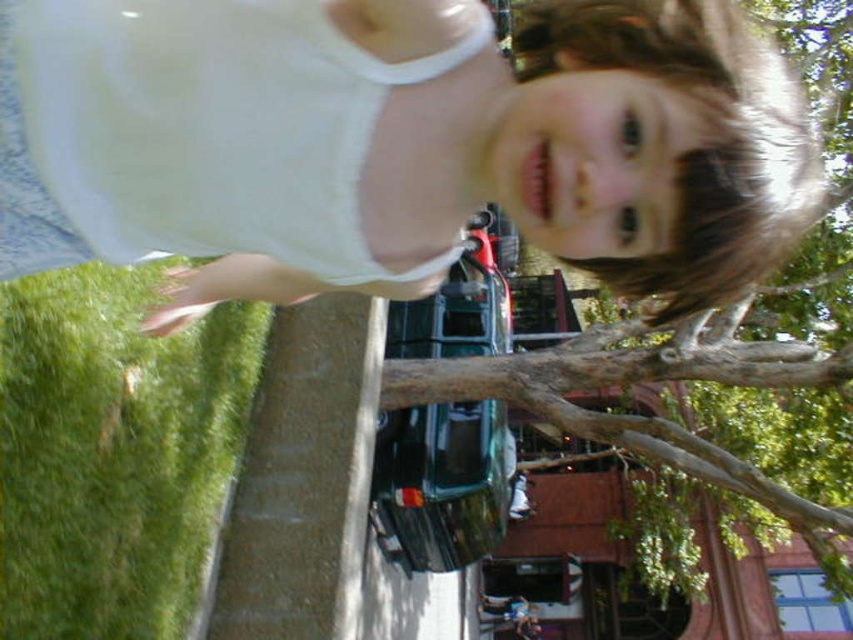
Question: Is white cotton shirt at upper center smaller than brown rough tree at upper center?

Choices:
 (A) no
 (B) yes

Answer: (B)

Question: Observing the image, what is the correct spatial positioning of white cotton shirt at upper center in reference to brown rough tree at upper center?

Choices:
 (A) left
 (B) right

Answer: (A)

Question: Which object is the farthest from the brown rough tree branch at center?

Choices:
 (A) white cotton shirt at upper center
 (B) brown rough tree at upper center

Answer: (A)

Question: Which point is closer to the camera?

Choices:
 (A) (135, 161)
 (B) (668, 440)

Answer: (A)

Question: Is white cotton shirt at upper center smaller than brown rough tree branch at center?

Choices:
 (A) no
 (B) yes

Answer: (B)

Question: Estimate the real-world distances between objects in this image. Which object is farther from the white cotton shirt at upper center?

Choices:
 (A) brown rough tree branch at center
 (B) brown rough tree at upper center

Answer: (A)